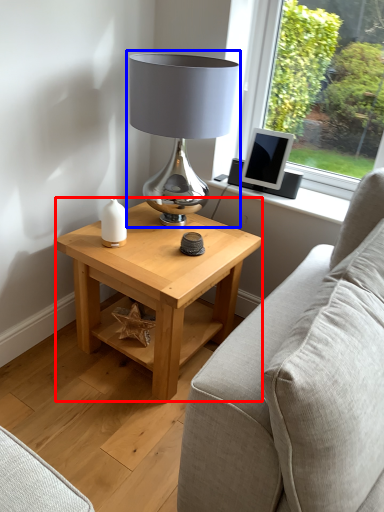
Question: Among these objects, which one is farthest to the camera, table (highlighted by a red box) or lamp (highlighted by a blue box)?

Choices:
 (A) table
 (B) lamp

Answer: (A)